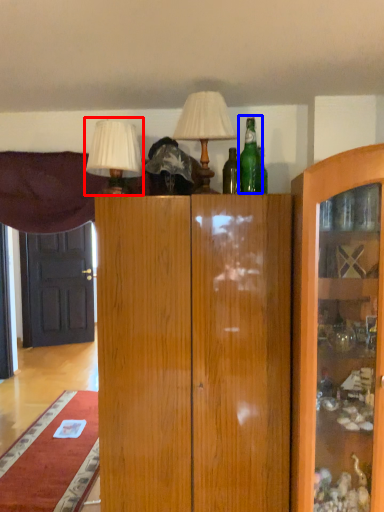
Question: Which object appears closest to the camera in this image, table lamp (highlighted by a red box) or bottle (highlighted by a blue box)?

Choices:
 (A) table lamp
 (B) bottle

Answer: (A)